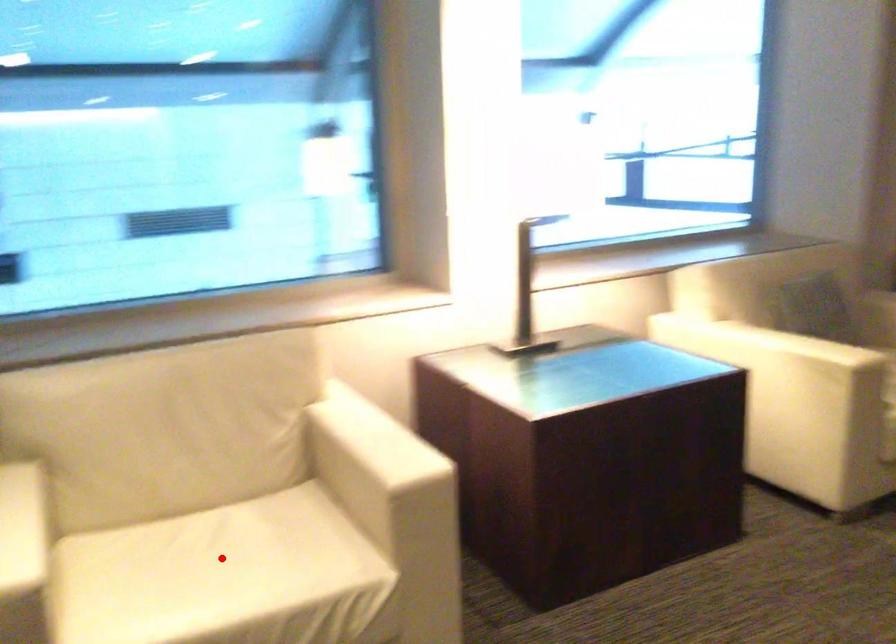
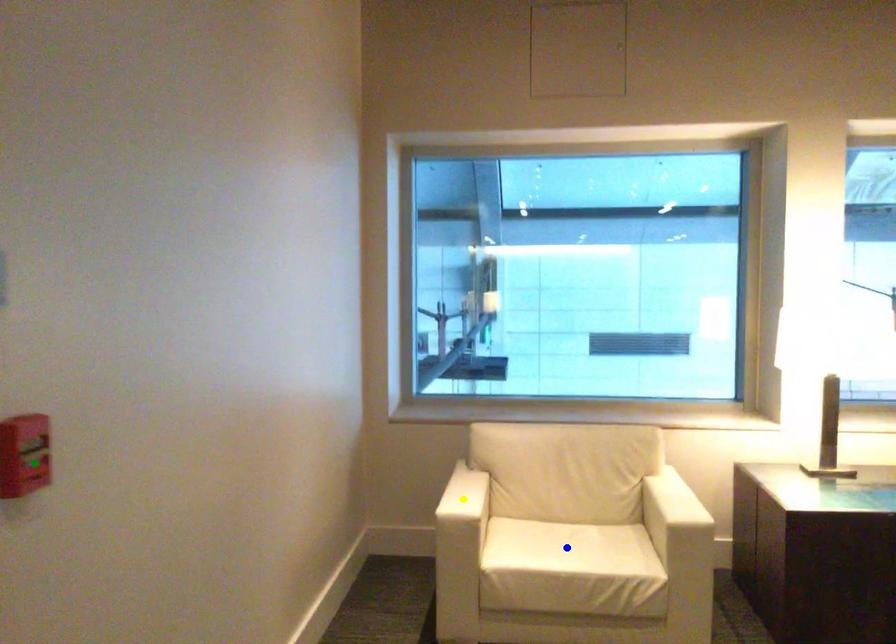
Question: I am providing you with two images of the same scene from different viewpoints. A red point is marked on the first image. You are given multiple points on the second image. Which spot in image 2 lines up with the point in image 1?

Choices:
 (A) yellow point
 (B) green point
 (C) blue point

Answer: (C)